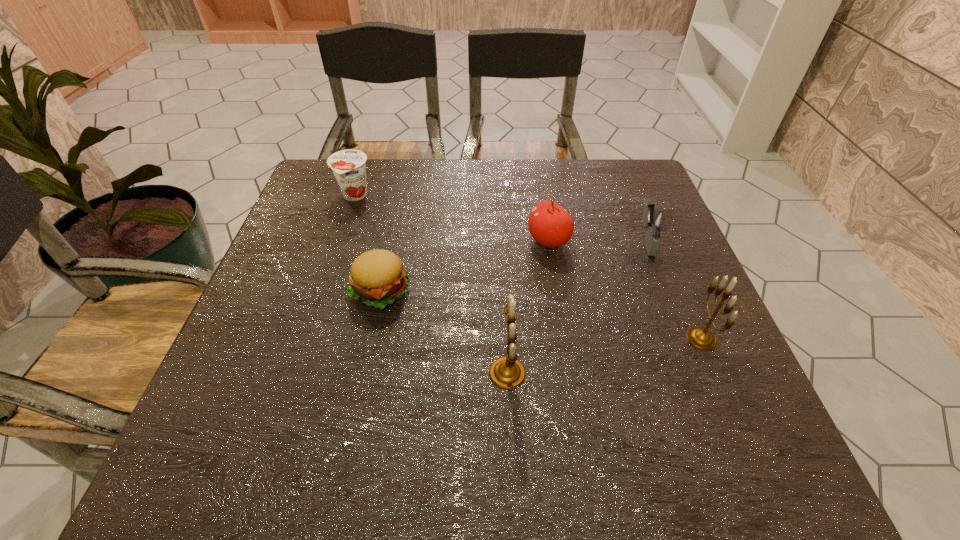
Find the location of a particular element. This screenshot has width=960, height=540. free space located 0.350m on the back of the taller candelabrum is located at coordinates (500, 231).

Where is `vacant space situated on the left of the right candelabrum`? vacant space situated on the left of the right candelabrum is located at coordinates (506, 338).

This screenshot has height=540, width=960. Identify the location of vacant space located on the right of the yogurt. (443, 196).

The width and height of the screenshot is (960, 540). What are the coordinates of `free region located 0.350m on the right of the hamburger` in the screenshot? It's located at (569, 291).

You are a GUI agent. You are given a task and a screenshot of the screen. Output one action in this format:
    pyautogui.click(x=<x>, y=<y>)
    Task: Click on the vacant position located 0.150m on the left of the fourth object from left to right
    
    Given the screenshot: What is the action you would take?
    pyautogui.click(x=466, y=241)

Locate an element on the screen. This screenshot has width=960, height=540. vacant region located on the left of the igniter is located at coordinates (495, 241).

Where is `object positioned at the far edge`? Image resolution: width=960 pixels, height=540 pixels. object positioned at the far edge is located at coordinates (349, 168).

This screenshot has height=540, width=960. I want to click on object located in the near edge section of the desktop, so pos(507,372).

Where is `object at the left edge`? object at the left edge is located at coordinates (349, 168).

Image resolution: width=960 pixels, height=540 pixels. I want to click on candelabrum at the right edge, so click(702, 338).